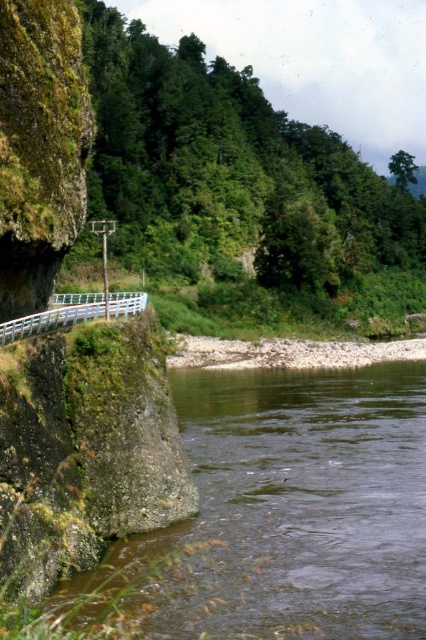
Can you confirm if green mossy rock at lower left is positioned above white plastic railing at lower left?

No, green mossy rock at lower left is not above white plastic railing at lower left.

Does green mossy rock at lower left appear on the left side of white plastic railing at lower left?

In fact, green mossy rock at lower left is to the right of white plastic railing at lower left.

Which is in front, point (414, 605) or point (34, 324)?

Point (414, 605) is in front.

Where is `green mossy rock at lower left`? green mossy rock at lower left is located at coordinates (288, 509).